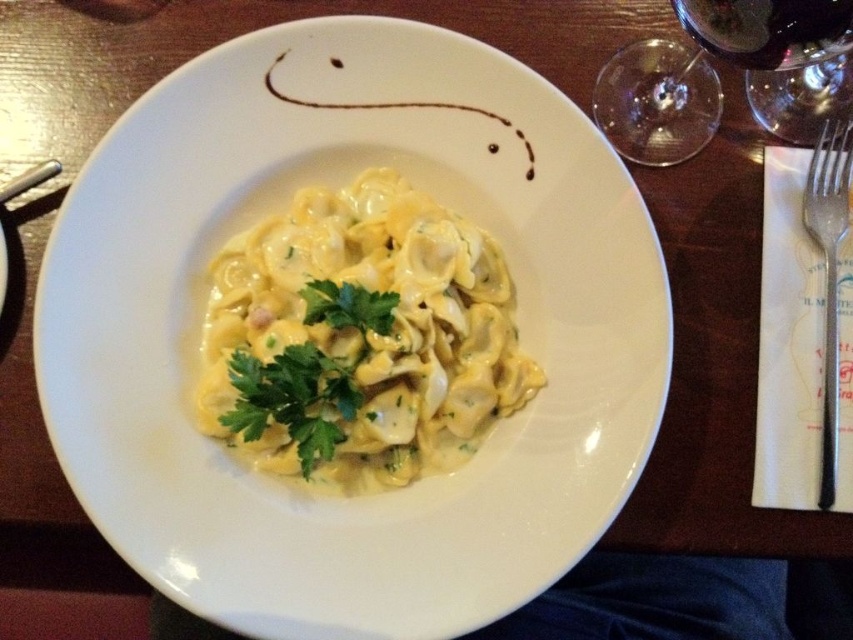
Question: Which point appears farthest from the camera in this image?

Choices:
 (A) (718, 35)
 (B) (848, 99)

Answer: (B)

Question: Which is nearer to the satin silver fork at right?

Choices:
 (A) green leafy parsley at center
 (B) dark red glass at upper right
 (C) yellow creamy pasta at center
 (D) transparent glass at upper right

Answer: (D)

Question: Which point is closer to the camera?

Choices:
 (A) (764, 13)
 (B) (222, 314)
 (C) (637, 154)

Answer: (A)

Question: Can you confirm if white glossy plate at center is smaller than dark red glass at upper right?

Choices:
 (A) no
 (B) yes

Answer: (A)

Question: Is yellow creamy pasta at center to the left of satin silver fork at right from the viewer's perspective?

Choices:
 (A) no
 (B) yes

Answer: (B)

Question: Considering the relative positions of yellow creamy pasta at center and transparent glass at upper right in the image provided, where is yellow creamy pasta at center located with respect to transparent glass at upper right?

Choices:
 (A) left
 (B) right

Answer: (A)